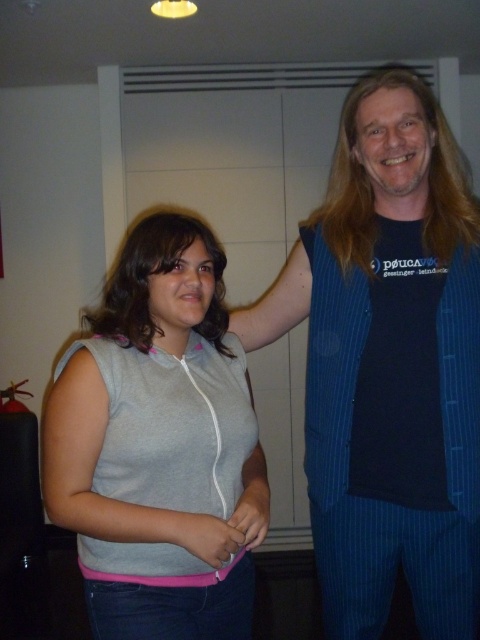
Between gray fabric sleeveless top at center and pink fabric hand at center, which one is positioned lower?

pink fabric hand at center is lower down.

Does gray fabric sleeveless top at center appear on the right side of pink fabric hand at center?

In fact, gray fabric sleeveless top at center is to the left of pink fabric hand at center.

Image resolution: width=480 pixels, height=640 pixels. I want to click on gray fabric sleeveless top at center, so click(x=156, y=442).

Between blue pinstripe vest at center and pink fabric hand at center, which one has more height?

blue pinstripe vest at center is taller.

Does blue pinstripe vest at center appear on the right side of pink fabric hand at center?

Indeed, blue pinstripe vest at center is positioned on the right side of pink fabric hand at center.

This screenshot has width=480, height=640. What do you see at coordinates (388, 364) in the screenshot? I see `blue pinstripe vest at center` at bounding box center [388, 364].

The height and width of the screenshot is (640, 480). What are the coordinates of `blue pinstripe vest at center` in the screenshot? It's located at (388, 364).

Is blue pinstripe vest at center positioned before gray fabric sleeveless top at center?

That is False.

Does blue pinstripe vest at center appear on the left side of gray fabric sleeveless top at center?

Incorrect, blue pinstripe vest at center is not on the left side of gray fabric sleeveless top at center.

The width and height of the screenshot is (480, 640). What do you see at coordinates (388, 364) in the screenshot?
I see `blue pinstripe vest at center` at bounding box center [388, 364].

At what (x,y) coordinates should I click in order to perform the action: click on blue pinstripe vest at center. Please return your answer as a coordinate pair (x, y). This screenshot has width=480, height=640. Looking at the image, I should click on (388, 364).